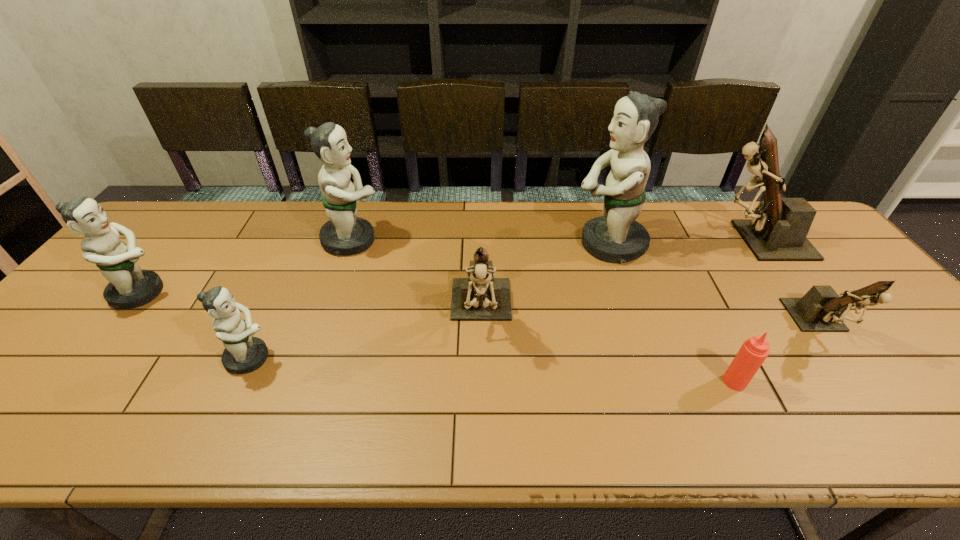
Image resolution: width=960 pixels, height=540 pixels. I want to click on unoccupied position between the second smallest brown figurine and the farthest brown figurine, so click(x=618, y=276).

You are a GUI agent. You are given a task and a screenshot of the screen. Output one action in this format:
    pyautogui.click(x=<x>, y=<y>)
    Task: Click on the sixth closest object to the tallest figurine
    
    Given the screenshot: What is the action you would take?
    pyautogui.click(x=243, y=353)

This screenshot has width=960, height=540. What are the coordinates of `object that ranks as the sixth closest to the third biggest green figurine` in the screenshot? It's located at (778, 229).

Where is `the third closest figurine to the biggest brown figurine`? The width and height of the screenshot is (960, 540). the third closest figurine to the biggest brown figurine is located at coordinates (480, 297).

Where is `figurine that is the second closest one to the biggest green figurine`? figurine that is the second closest one to the biggest green figurine is located at coordinates pyautogui.click(x=480, y=297).

Find the location of a particular element. The height and width of the screenshot is (540, 960). green figurine that stands as the closest to the smallest brown figurine is located at coordinates (616, 236).

Locate an element on the screen. green figurine that is the fourth closest to the Tabasco sauce is located at coordinates (129, 286).

Select which brown figurine is the closest to the smallest green figurine. Please provide its 2D coordinates. Your answer should be formatted as a tuple, i.e. [(x, y)], where the tuple contains the x and y coordinates of a point satisfying the conditions above.

[(480, 297)]

In order to click on brown figurine that is the second closest to the smallest brown figurine in this screenshot , I will do `click(480, 297)`.

Identify the location of vacant space that satisfies the following two spatial constraints: 1. on the front-facing side of the biggest brown figurine; 2. on the front-facing side of the fourth figurine from right to left. This screenshot has height=540, width=960. (808, 313).